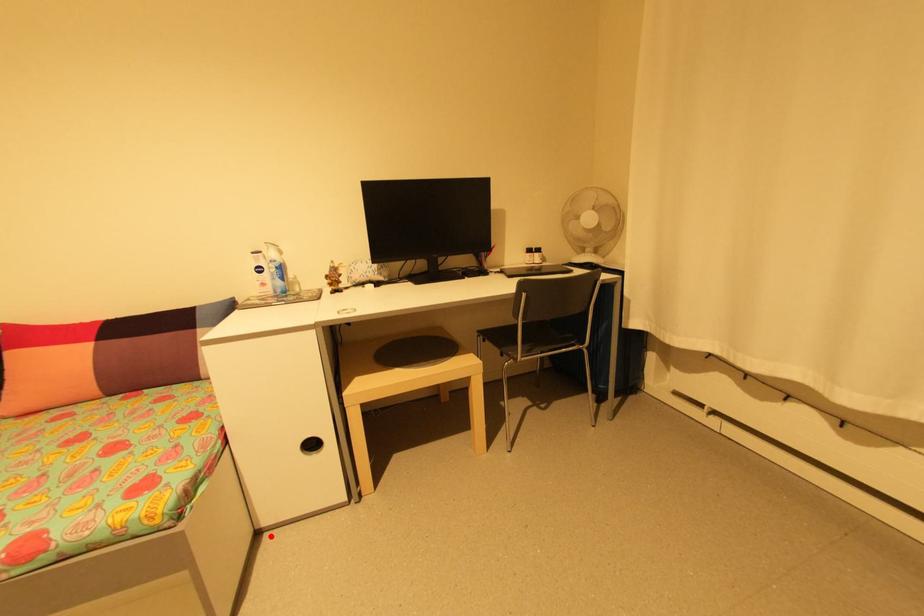
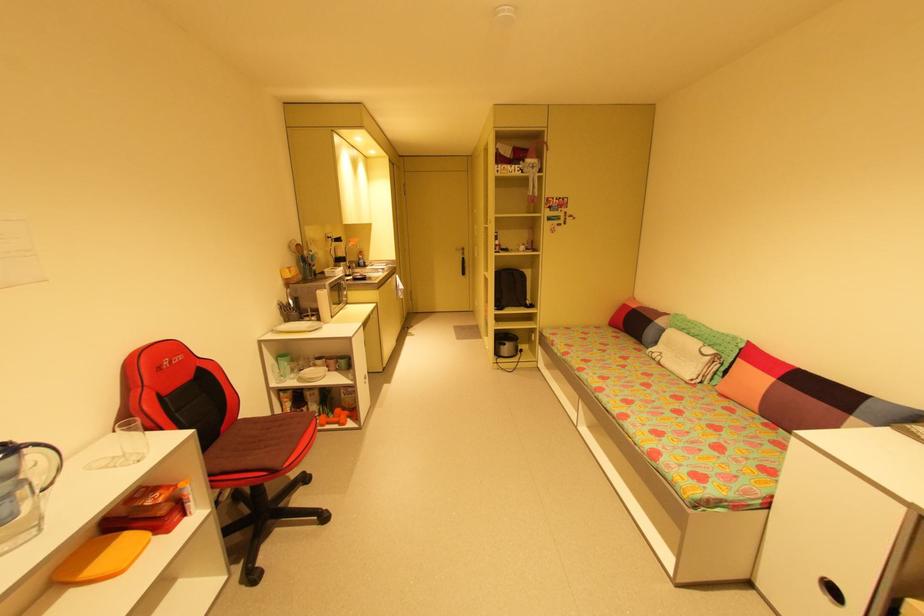
The point at the highlighted location is marked in the first image. Where is the corresponding point in the second image?

(758, 593)